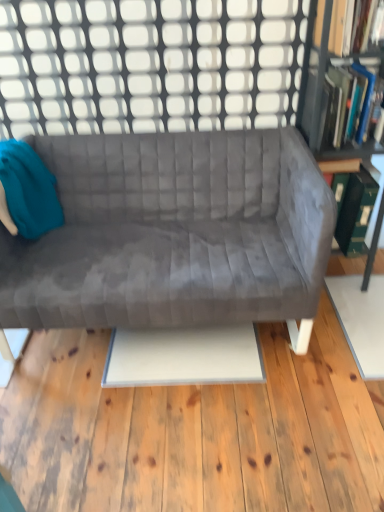
Question: Considering the positions of point (307, 55) and point (49, 24), is point (307, 55) closer or farther from the camera than point (49, 24)?

Choices:
 (A) closer
 (B) farther

Answer: (A)

Question: In terms of width, does green cardboard bookcase at right look wider or thinner when compared to white grid at upper center?

Choices:
 (A) wide
 (B) thin

Answer: (A)

Question: Which object is the closest to the teal fabric bean bag chair at left?

Choices:
 (A) green cardboard bookcase at right
 (B) white grid at upper center
 (C) velvet gray couch at center
 (D) hardcover book at upper right, which is the 2th book from top to bottom
 (E) green cardboard at right

Answer: (C)

Question: Based on their relative distances, which object is farther from the green cardboard at right?

Choices:
 (A) green cardboard bookcase at right
 (B) hardcover book at upper right, placed as the 1th book when sorted from top to bottom
 (C) white grid at upper center
 (D) velvet gray couch at center
 (E) hardcover book at upper right, which appears as the 1th book when ordered from the bottom

Answer: (C)